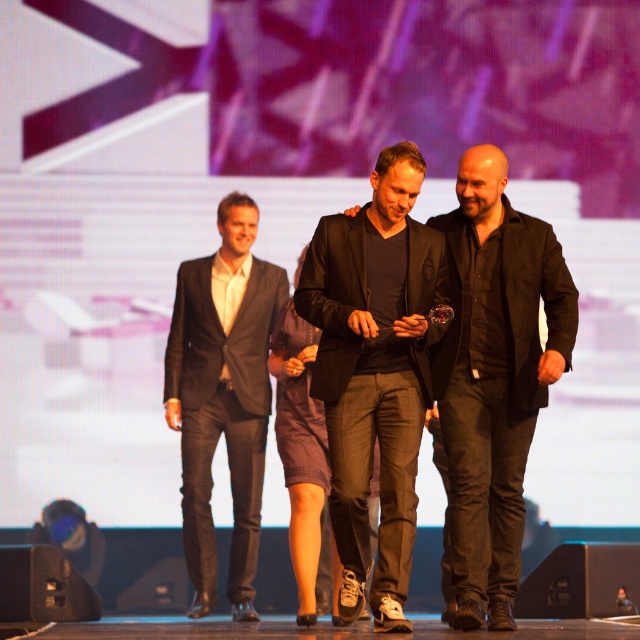
Is point (497, 148) in front of point (212, 403)?

Yes, point (497, 148) is in front of point (212, 403).

How much distance is there between black matte jacket at center and dark gray suit at left?

black matte jacket at center and dark gray suit at left are 2.94 meters apart.

Between point (500, 234) and point (209, 310), which one is positioned behind?

Point (209, 310)

Where is `black matte jacket at center`? The height and width of the screenshot is (640, 640). black matte jacket at center is located at coordinates (493, 376).

Between black matte suit at center and dark gray suit at left, which one has more height?

With more height is dark gray suit at left.

Can you confirm if black matte suit at center is thinner than dark gray suit at left?

Correct, black matte suit at center's width is less than dark gray suit at left's.

Describe the element at coordinates (374, 371) in the screenshot. The width and height of the screenshot is (640, 640). I see `black matte suit at center` at that location.

The width and height of the screenshot is (640, 640). Identify the location of black matte suit at center. (374, 371).

Can you confirm if black matte suit at center is positioned above black matte jacket at center?

Correct, black matte suit at center is located above black matte jacket at center.

Between point (323, 250) and point (476, 579), which one is positioned behind?

Positioned behind is point (323, 250).

The height and width of the screenshot is (640, 640). Find the location of `black matte suit at center`. black matte suit at center is located at coordinates pos(374,371).